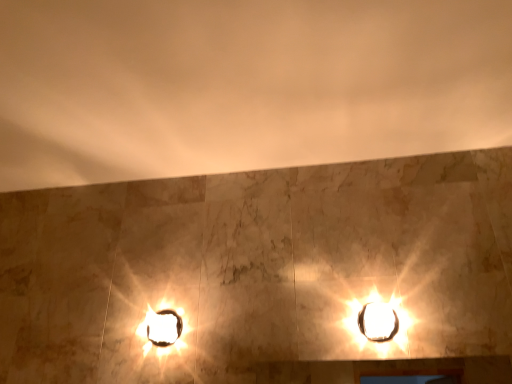
Question: Is matte glass lamp at upper right beside white glossy stage light at lower left?

Choices:
 (A) yes
 (B) no

Answer: (B)

Question: Is matte glass lamp at upper right further to camera compared to white glossy stage light at lower left?

Choices:
 (A) no
 (B) yes

Answer: (A)

Question: Considering the relative positions of matte glass lamp at upper right and white glossy stage light at lower left in the image provided, is matte glass lamp at upper right in front of white glossy stage light at lower left?

Choices:
 (A) no
 (B) yes

Answer: (B)

Question: From a real-world perspective, is matte glass lamp at upper right physically above white glossy stage light at lower left?

Choices:
 (A) yes
 (B) no

Answer: (A)

Question: Can you confirm if matte glass lamp at upper right is smaller than white glossy stage light at lower left?

Choices:
 (A) yes
 (B) no

Answer: (B)

Question: Is matte glass lamp at upper right located outside white glossy stage light at lower left?

Choices:
 (A) yes
 (B) no

Answer: (A)

Question: Does white glossy stage light at lower left have a lesser height compared to matte glass lamp at upper right?

Choices:
 (A) yes
 (B) no

Answer: (A)

Question: Is white glossy stage light at lower left in contact with matte glass lamp at upper right?

Choices:
 (A) no
 (B) yes

Answer: (A)

Question: Considering the relative positions of white glossy stage light at lower left and matte glass lamp at upper right in the image provided, is white glossy stage light at lower left to the left of matte glass lamp at upper right from the viewer's perspective?

Choices:
 (A) yes
 (B) no

Answer: (A)

Question: From the image's perspective, is white glossy stage light at lower left over matte glass lamp at upper right?

Choices:
 (A) no
 (B) yes

Answer: (A)

Question: Does white glossy stage light at lower left have a larger size compared to matte glass lamp at upper right?

Choices:
 (A) no
 (B) yes

Answer: (A)

Question: Does white glossy stage light at lower left have a lesser width compared to matte glass lamp at upper right?

Choices:
 (A) yes
 (B) no

Answer: (A)

Question: Relative to matte glass lamp at upper right, is white glossy stage light at lower left in front or behind?

Choices:
 (A) front
 (B) behind

Answer: (B)